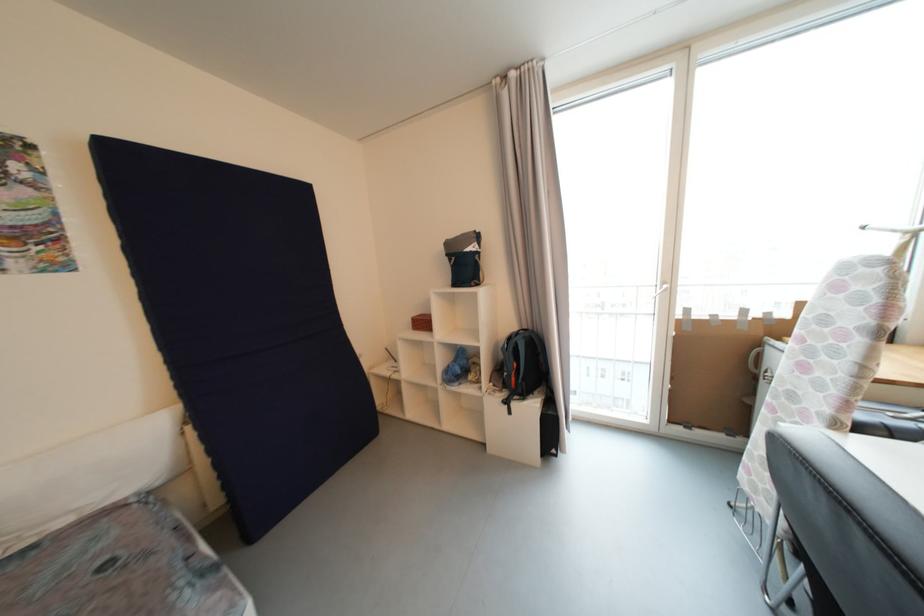
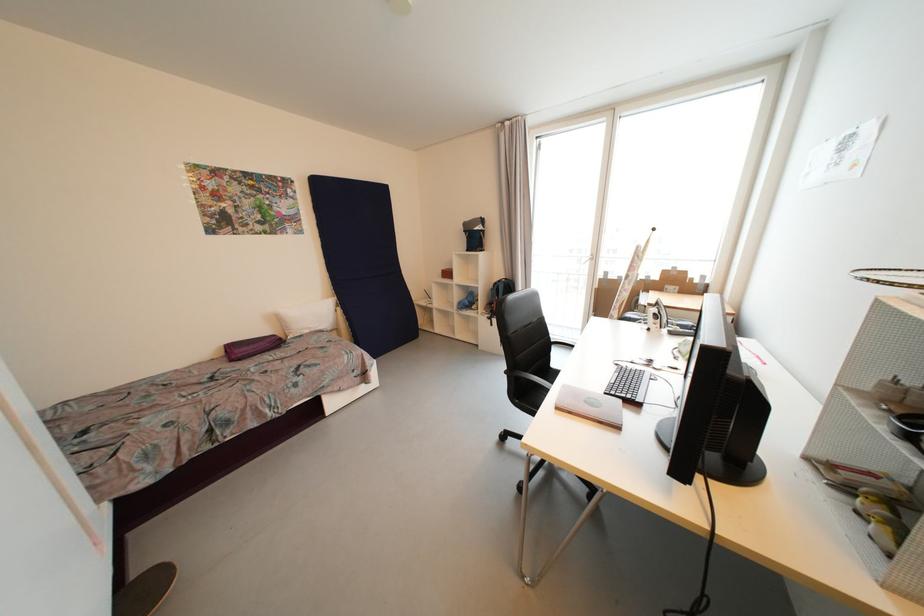
Locate, in the second image, the point that corresponds to pixel 515 341 in the first image.

(501, 285)